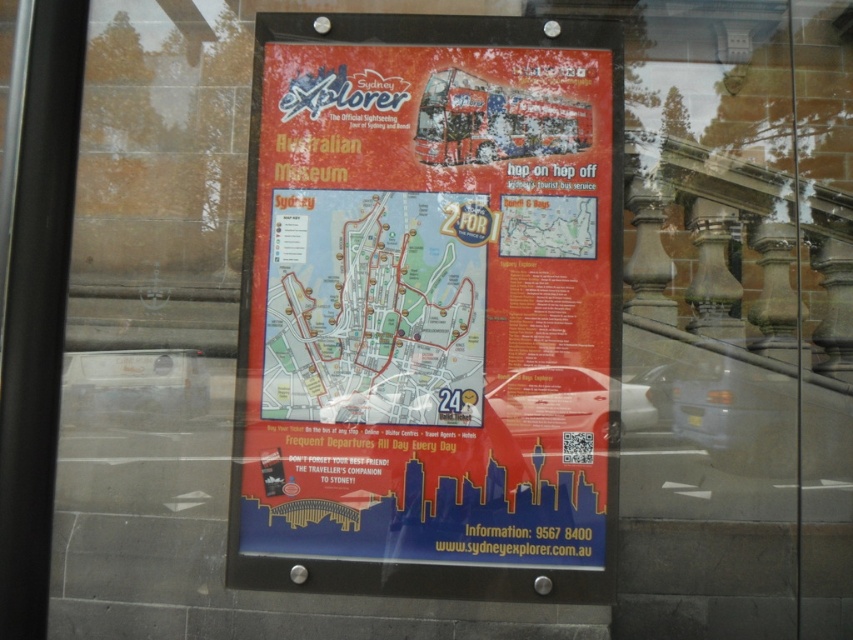
Which is more to the left, red matte poster at center or blue paper map at center?

blue paper map at center is more to the left.

Who is shorter, red matte poster at center or blue paper map at center?

blue paper map at center is shorter.

Locate an element on the screen. red matte poster at center is located at coordinates (430, 307).

At what (x,y) coordinates should I click in order to perform the action: click on red matte poster at center. Please return your answer as a coordinate pair (x, y). Image resolution: width=853 pixels, height=640 pixels. Looking at the image, I should click on (430, 307).